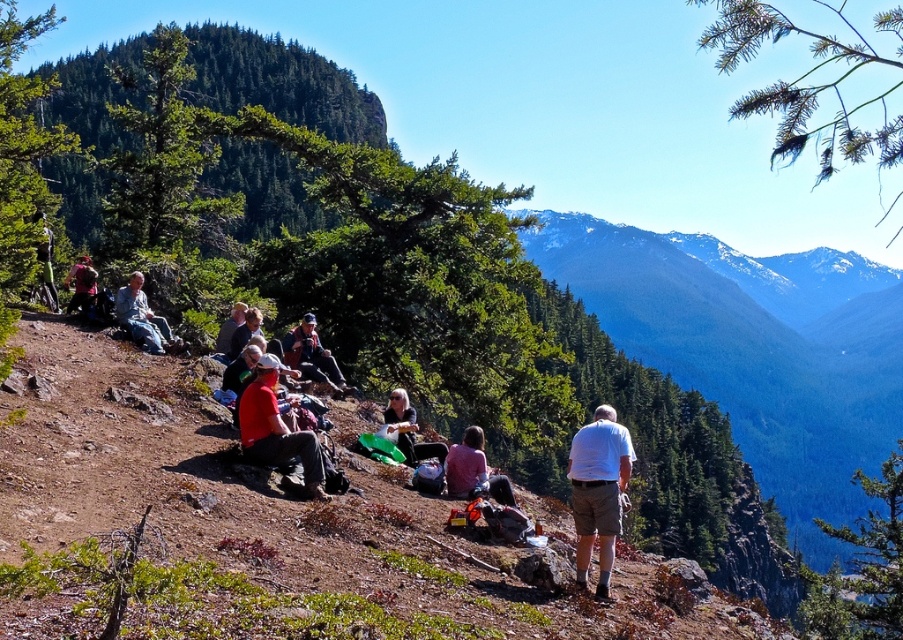
Does reddish-brown leather jacket at center lie behind matte black backpack at left?

Yes, reddish-brown leather jacket at center is further from the viewer.

What do you see at coordinates (312, 355) in the screenshot?
I see `reddish-brown leather jacket at center` at bounding box center [312, 355].

Is point (285, 362) positioned in front of point (51, 259)?

Yes, point (285, 362) is in front of point (51, 259).

Identify the location of reddish-brown leather jacket at center. (312, 355).

Does denim jacket at upper left have a greater width compared to matte black backpack at left?

Incorrect, denim jacket at upper left's width does not surpass matte black backpack at left's.

Between denim jacket at upper left and matte black backpack at left, which one appears on the right side from the viewer's perspective?

Positioned to the right is denim jacket at upper left.

Who is more distant from viewer, (115, 314) or (45, 248)?

The point (45, 248) is behind.

This screenshot has width=903, height=640. I want to click on denim jacket at upper left, so click(x=142, y=317).

Does matte black jacket at center have a lesser height compared to matte black backpack at left?

Yes.

The image size is (903, 640). I want to click on matte black jacket at center, so click(x=410, y=429).